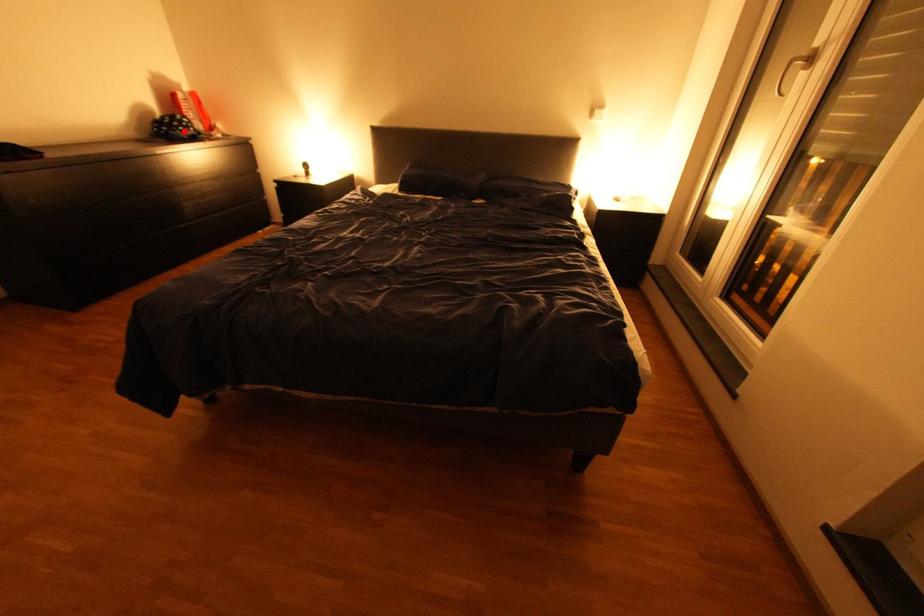
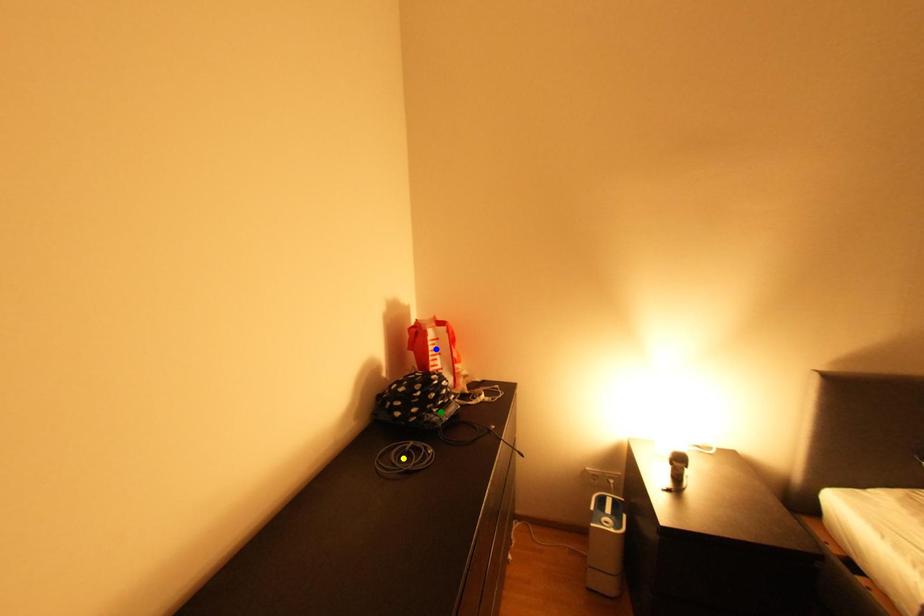
Question: I am providing you with two images of the same scene from different viewpoints. A red point is marked on the first image. You are given multiple points on the second image. Can you choose the point in image 2 that corresponds to the point in image 1?

Choices:
 (A) green point
 (B) blue point
 (C) yellow point

Answer: (A)